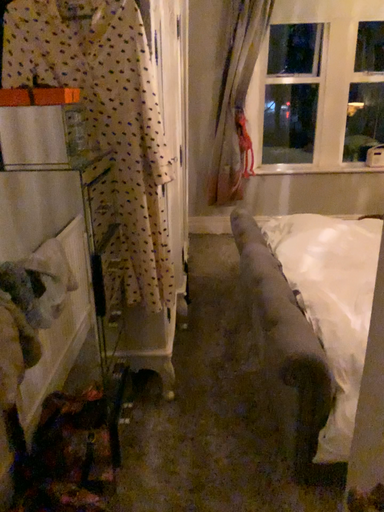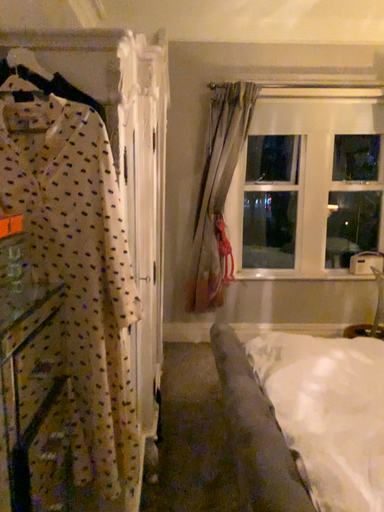
Question: How did the camera likely rotate when shooting the video?

Choices:
 (A) rotated upward
 (B) rotated downward

Answer: (A)